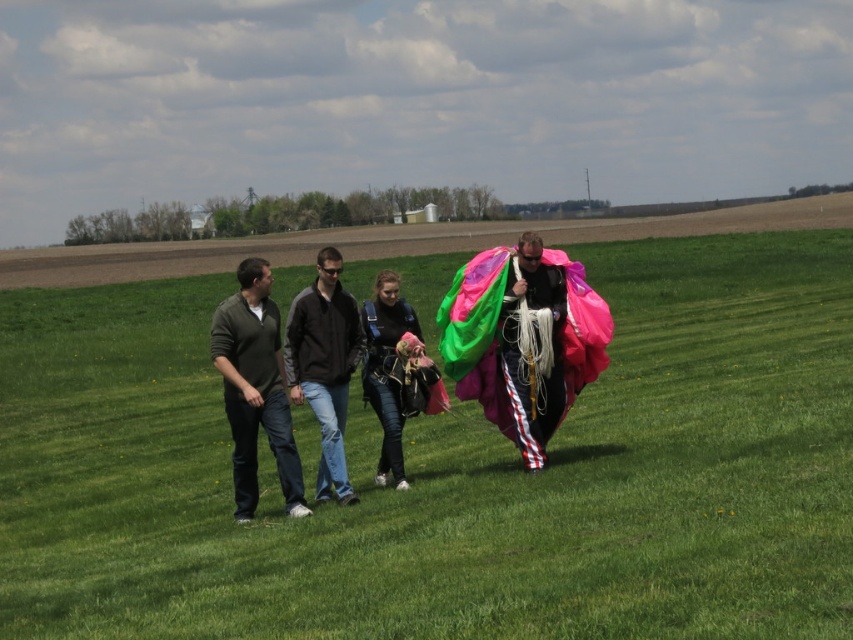
Question: Can you confirm if black jacket at center is bigger than denim jacket at center?

Choices:
 (A) no
 (B) yes

Answer: (B)

Question: Which point appears farthest from the camera in this image?

Choices:
 (A) (567, 288)
 (B) (216, 572)
 (C) (318, 346)

Answer: (A)

Question: Is multicolored fabric parachute at center in front of green matte shirt at left?

Choices:
 (A) yes
 (B) no

Answer: (B)

Question: Based on their relative distances, which object is farther from the green matte shirt at left?

Choices:
 (A) black jacket at center
 (B) green grass field at center
 (C) denim jacket at center
 (D) multicolored fabric parachute at center

Answer: (B)

Question: Which of the following is the farthest from the observer?

Choices:
 (A) (577, 445)
 (B) (289, 324)
 (C) (242, 276)

Answer: (A)

Question: Can you confirm if green matte shirt at left is smaller than denim jacket at center?

Choices:
 (A) yes
 (B) no

Answer: (B)